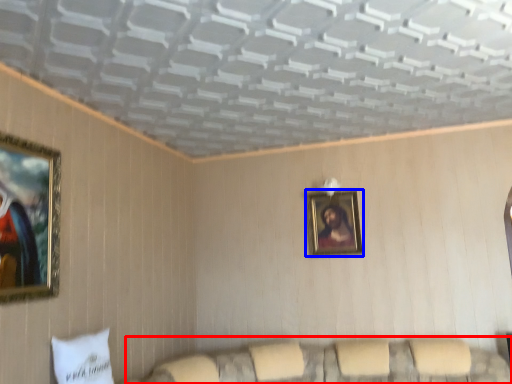
Question: Which object is closer to the camera taking this photo, couch (highlighted by a red box) or picture frame (highlighted by a blue box)?

Choices:
 (A) couch
 (B) picture frame

Answer: (A)